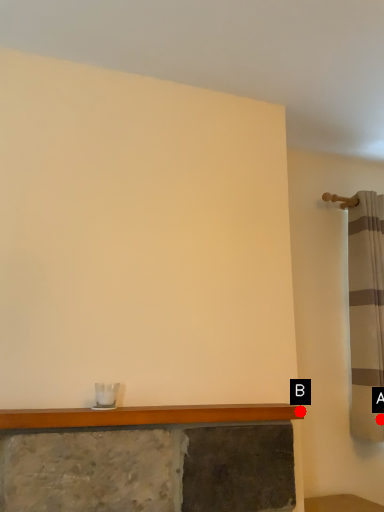
Question: Two points are circled on the image, labeled by A and B beside each circle. Which point is closer to the camera?

Choices:
 (A) A is closer
 (B) B is closer

Answer: (B)